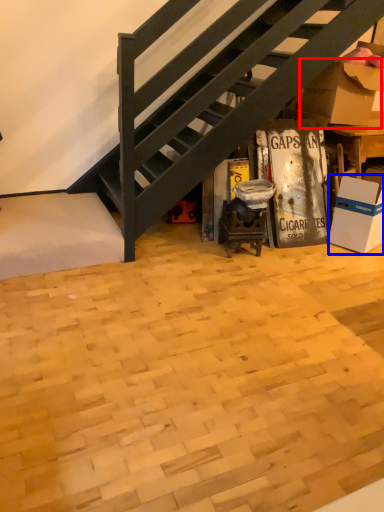
Question: Which object is further to the camera taking this photo, cardboard box (highlighted by a red box) or box (highlighted by a blue box)?

Choices:
 (A) cardboard box
 (B) box

Answer: (A)